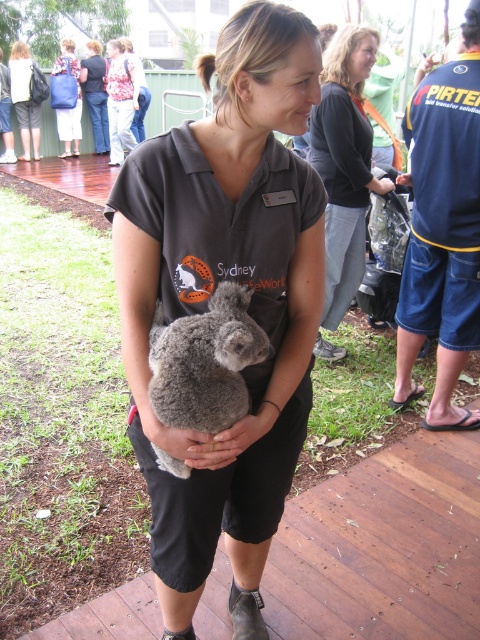
You are a photographer trying to capture a clear photo of the fuzzy gray koala at center and the matte black shirt at center. Since the koala is smaller, which object should you zoom in on more to ensure both are equally visible in the photo?

The fuzzy gray koala at center has a smaller size compared to the matte black shirt at center. To make both equally visible, you should zoom in more on the fuzzy gray koala at center to enlarge its appearance in the photo.

Based on the scene description, which object is narrower between the fuzzy gray koala at center and the matte black shirt at center?

The fuzzy gray koala at center has a lesser width compared to the matte black shirt at center, so it is narrower.

You are a photographer trying to capture the koala in the woman holding it. Based on the scene, which object is positioned lower in the image between the fuzzy gray koala at center and the matte black shirt at center?

The fuzzy gray koala at center is positioned below the matte black shirt at center, so it is lower in the image.